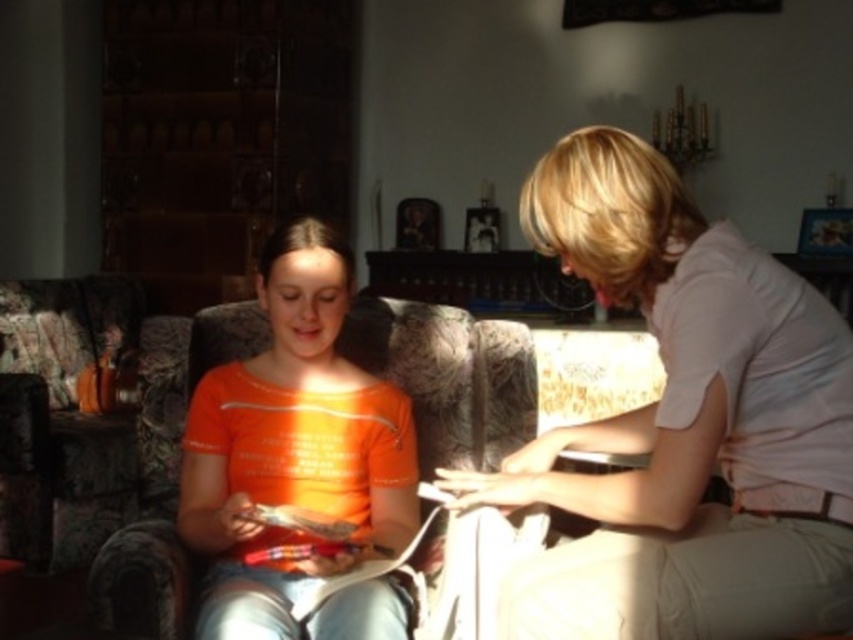
Question: Estimate the real-world distances between objects in this image. Which object is closer to the textured fabric couch at center?

Choices:
 (A) orange cotton shirt at center
 (B) light beige cotton shirt at upper right

Answer: (A)

Question: Which of the following is the farthest from the observer?

Choices:
 (A) (376, 588)
 (B) (350, 339)
 (C) (828, 413)

Answer: (B)

Question: Which object appears farthest from the camera in this image?

Choices:
 (A) orange cotton shirt at center
 (B) textured fabric couch at center

Answer: (B)

Question: Does light beige cotton shirt at upper right come in front of textured fabric couch at center?

Choices:
 (A) yes
 (B) no

Answer: (A)

Question: Does orange cotton shirt at center appear on the right side of textured fabric couch at center?

Choices:
 (A) yes
 (B) no

Answer: (A)

Question: Can you confirm if light beige cotton shirt at upper right is smaller than orange cotton shirt at center?

Choices:
 (A) no
 (B) yes

Answer: (A)